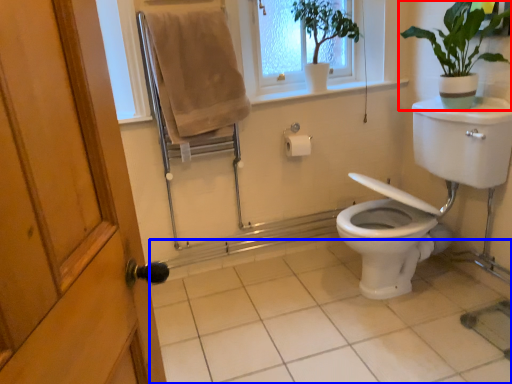
Question: Among these objects, which one is farthest to the camera, houseplant (highlighted by a red box) or tile (highlighted by a blue box)?

Choices:
 (A) houseplant
 (B) tile

Answer: (A)